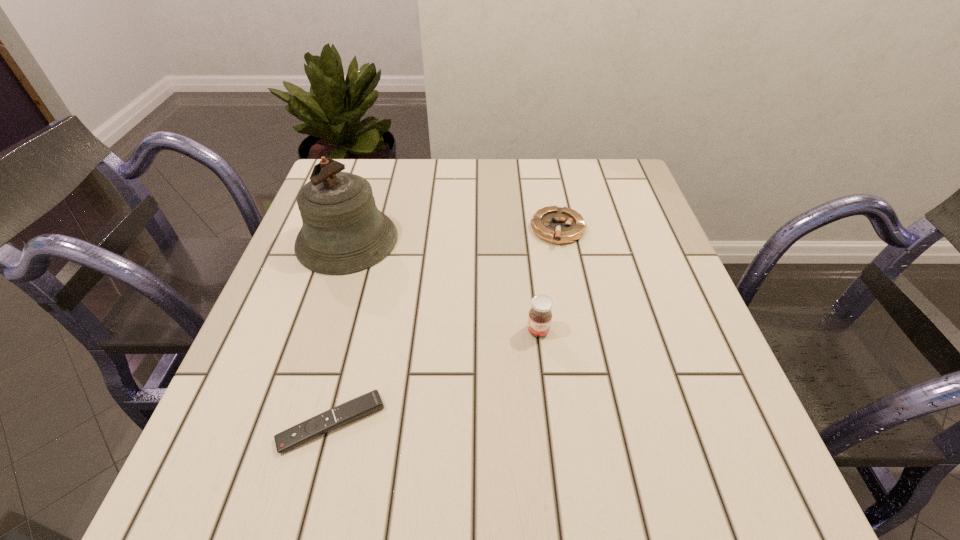
In the image, there is a desktop. Identify the location of vacant area at the near right corner. (724, 452).

Identify the location of unoccupied position between the third shortest object and the third tallest object. The width and height of the screenshot is (960, 540). (548, 280).

Identify the location of free area in between the ashtray and the shortest object. The image size is (960, 540). (444, 326).

I want to click on vacant space in between the second nearest object and the nearest object, so click(x=435, y=377).

The width and height of the screenshot is (960, 540). In order to click on vacant space that is in between the third tallest object and the shortest object in this screenshot , I will do `click(444, 326)`.

Locate an element on the screen. unoccupied area between the bell and the jam is located at coordinates (443, 286).

Locate an element on the screen. The width and height of the screenshot is (960, 540). vacant area between the bell and the remote control is located at coordinates (340, 332).

What are the coordinates of `free space between the third tallest object and the third shortest object` in the screenshot? It's located at (548, 280).

The height and width of the screenshot is (540, 960). I want to click on free space between the shortest object and the third shortest object, so click(435, 377).

I want to click on blank region between the tallest object and the shortest object, so click(x=340, y=332).